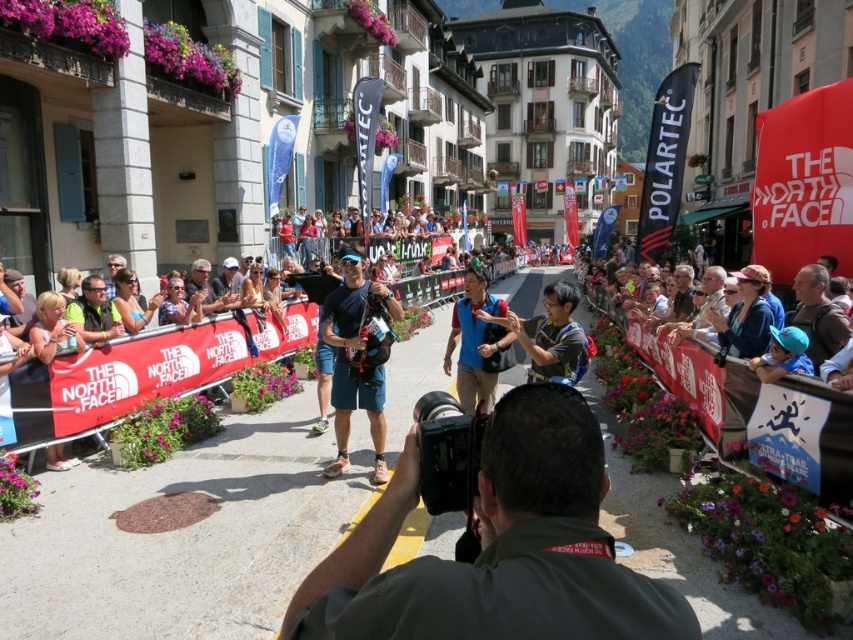
Is matte blue shorts at center below brown leather backpack at right?

Indeed, matte blue shorts at center is positioned under brown leather backpack at right.

Can you confirm if matte blue shorts at center is thinner than brown leather backpack at right?

No.

Who is more distant from viewer, (364, 372) or (811, 321)?

Point (364, 372)

At what (x,y) coordinates should I click in order to perform the action: click on matte blue shorts at center. Please return your answer as a coordinate pair (x, y). Looking at the image, I should click on (358, 356).

Who is shorter, matte blue shorts at center or matte black sunglasses at center?

matte black sunglasses at center

Can you confirm if matte blue shorts at center is shorter than matte black sunglasses at center?

In fact, matte blue shorts at center may be taller than matte black sunglasses at center.

Between point (354, 252) and point (73, 316), which one is positioned in front?

Point (354, 252) is in front.

Identify the location of matte blue shorts at center. Image resolution: width=853 pixels, height=640 pixels. (358, 356).

Who is taller, blue fabric vest at center or matte black sunglasses at center?

Standing taller between the two is matte black sunglasses at center.

Who is positioned more to the right, blue fabric vest at center or matte black sunglasses at center?

blue fabric vest at center is more to the right.

Who is more distant from viewer, (457, 365) or (115, 323)?

The point (115, 323) is more distant.

Where is `blue fabric vest at center`? blue fabric vest at center is located at coordinates (479, 342).